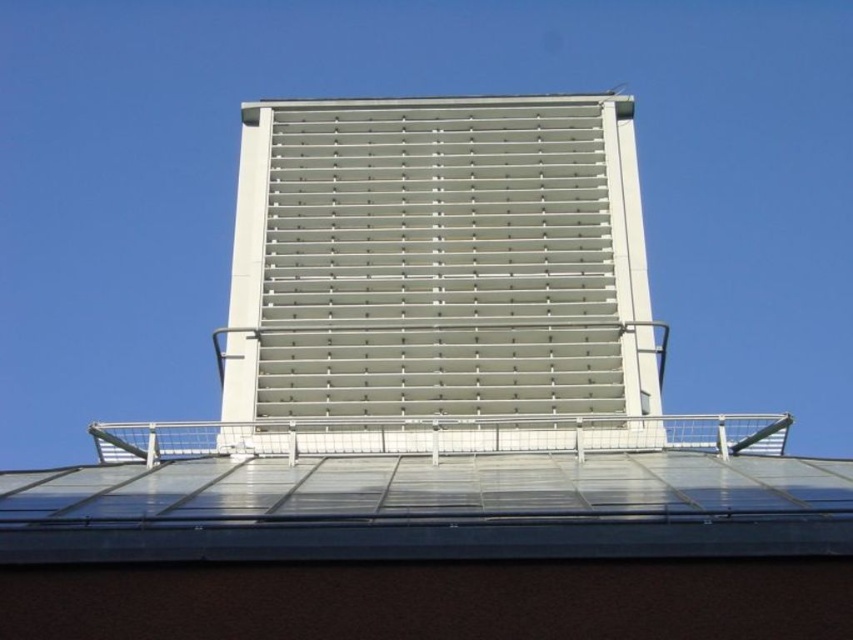
Question: Which of the following is the closest to the observer?

Choices:
 (A) (663, 461)
 (B) (508, 225)

Answer: (A)

Question: Which point is closer to the camera taking this photo?

Choices:
 (A) (434, 504)
 (B) (566, 221)

Answer: (A)

Question: Which of the following is the closest to the observer?

Choices:
 (A) (627, 456)
 (B) (392, 433)

Answer: (A)

Question: Does white metallic slats at center appear on the right side of transparent glass roof at center?

Choices:
 (A) yes
 (B) no

Answer: (A)

Question: Is white metallic slats at center positioned before transparent glass roof at center?

Choices:
 (A) no
 (B) yes

Answer: (A)

Question: Is white metallic slats at center positioned at the back of transparent glass roof at center?

Choices:
 (A) no
 (B) yes

Answer: (B)